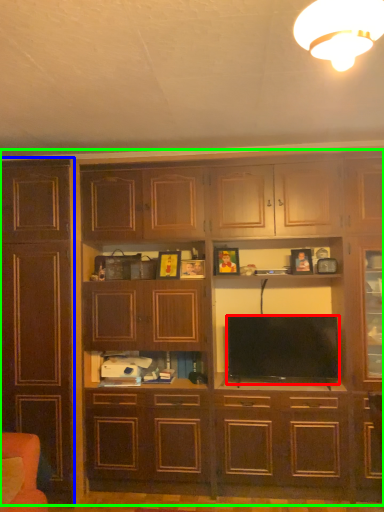
Question: Which is nearer to the television (highlighted by a red box)? cabinetry (highlighted by a blue box) or cupboard (highlighted by a green box).

Choices:
 (A) cabinetry
 (B) cupboard

Answer: (B)